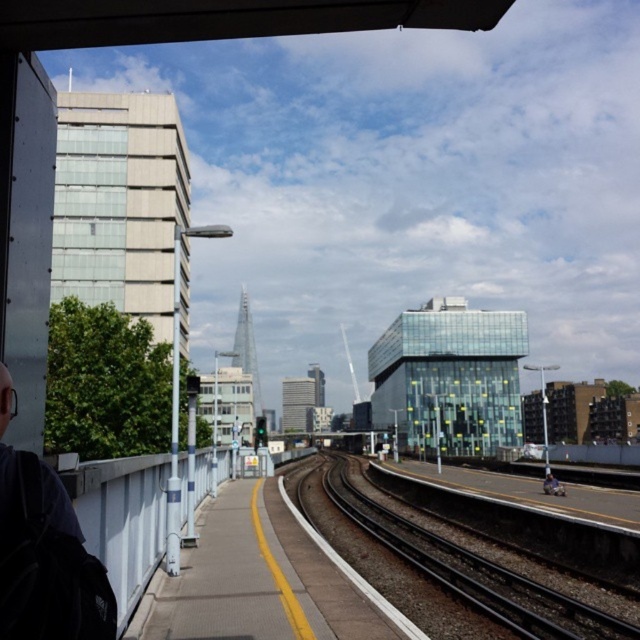
Question: Which object is positioned farthest from the black asphalt track at center?

Choices:
 (A) dark gray backpack at left
 (B) light blue denim jacket at lower right

Answer: (A)

Question: Does dark gray backpack at left have a larger size compared to black asphalt track at center?

Choices:
 (A) no
 (B) yes

Answer: (A)

Question: Observing the image, what is the correct spatial positioning of dark gray backpack at left in reference to light blue denim jacket at lower right?

Choices:
 (A) left
 (B) right

Answer: (A)

Question: Does black asphalt track at center appear under light blue denim jacket at lower right?

Choices:
 (A) yes
 (B) no

Answer: (A)

Question: Which is farther from the light blue denim jacket at lower right?

Choices:
 (A) black asphalt track at center
 (B) dark gray backpack at left

Answer: (B)

Question: Which of the following is the closest to the observer?

Choices:
 (A) dark gray backpack at left
 (B) light blue denim jacket at lower right
 (C) black asphalt track at center

Answer: (A)